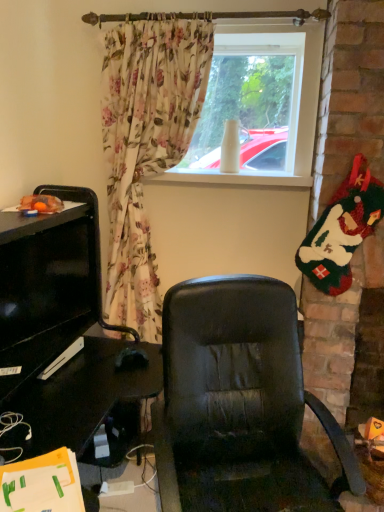
Question: In the image, is white matte vase at upper center on the left side or the right side of black matte mouse at lower left?

Choices:
 (A) left
 (B) right

Answer: (B)

Question: Considering the positions of white matte vase at upper center and black matte mouse at lower left in the image, is white matte vase at upper center taller or shorter than black matte mouse at lower left?

Choices:
 (A) short
 (B) tall

Answer: (B)

Question: Looking at the image, does white matte vase at upper center seem bigger or smaller compared to black matte mouse at lower left?

Choices:
 (A) small
 (B) big

Answer: (B)

Question: Would you say black matte mouse at lower left is inside or outside white matte vase at upper center?

Choices:
 (A) outside
 (B) inside

Answer: (A)

Question: Is black matte mouse at lower left wider or thinner than white matte vase at upper center?

Choices:
 (A) thin
 (B) wide

Answer: (B)

Question: Is point (127, 368) closer or farther from the camera than point (284, 66)?

Choices:
 (A) closer
 (B) farther

Answer: (A)

Question: In terms of height, does black matte mouse at lower left look taller or shorter compared to white matte vase at upper center?

Choices:
 (A) short
 (B) tall

Answer: (A)